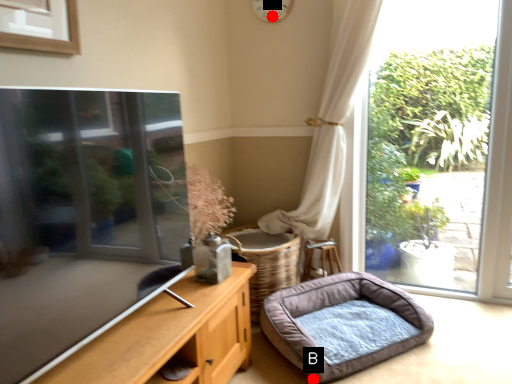
Question: Two points are circled on the image, labeled by A and B beside each circle. Which point is closer to the camera taking this photo?

Choices:
 (A) A is closer
 (B) B is closer

Answer: (B)